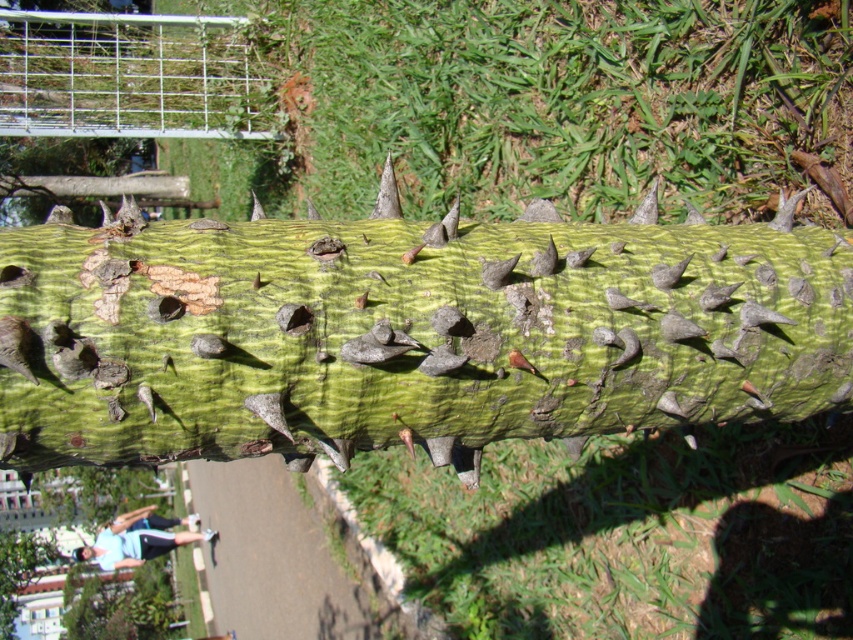
Is green rough bark at center bigger than blue fabric at lower left?

No.

Does green rough bark at center appear on the left side of blue fabric at lower left?

No, green rough bark at center is not to the left of blue fabric at lower left.

Is point (277, 403) closer to camera compared to point (109, 564)?

Yes, it is.

What are the coordinates of `green rough bark at center` in the screenshot? It's located at (404, 336).